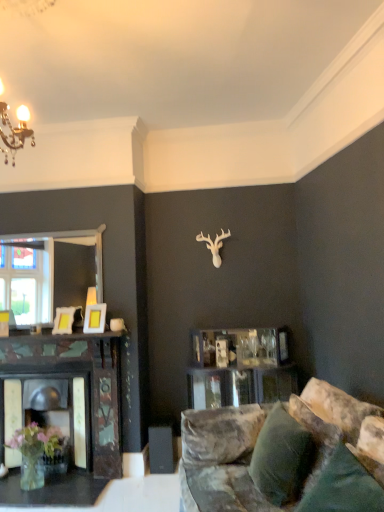
Question: Would you consider matte gold picture frame at left, the first picture frame when ordered from left to right, to be distant from velvety green pillow at lower right, arranged as the first pillow when viewed from the front?

Choices:
 (A) yes
 (B) no

Answer: (A)

Question: Is matte gold picture frame at left, placed as the second picture frame when sorted from right to left, bigger than velvety green pillow at lower right, the second pillow from the back?

Choices:
 (A) yes
 (B) no

Answer: (B)

Question: Considering the relative positions of matte gold picture frame at left, the first picture frame when ordered from left to right, and velvety green pillow at lower right, arranged as the first pillow when viewed from the front, in the image provided, is matte gold picture frame at left, the first picture frame when ordered from left to right, behind velvety green pillow at lower right, arranged as the first pillow when viewed from the front,?

Choices:
 (A) yes
 (B) no

Answer: (A)

Question: From a real-world perspective, is matte gold picture frame at left, placed as the second picture frame when sorted from right to left, physically above velvety green pillow at lower right, the second pillow from the back?

Choices:
 (A) no
 (B) yes

Answer: (B)

Question: From a real-world perspective, is matte gold picture frame at left, placed as the second picture frame when sorted from right to left, located beneath velvety green pillow at lower right, the second pillow from the back?

Choices:
 (A) no
 (B) yes

Answer: (A)

Question: Considering the relative positions of matte gold picture frame at left, placed as the second picture frame when sorted from right to left, and velvety green pillow at lower right, arranged as the first pillow when viewed from the front, in the image provided, is matte gold picture frame at left, placed as the second picture frame when sorted from right to left, to the right of velvety green pillow at lower right, arranged as the first pillow when viewed from the front, from the viewer's perspective?

Choices:
 (A) yes
 (B) no

Answer: (B)

Question: Considering the relative sizes of matte yellow picture frame at center, marked as the first picture frame in a right-to-left arrangement, and velvety green pillow at lower right, arranged as the first pillow when viewed from the front, in the image provided, is matte yellow picture frame at center, marked as the first picture frame in a right-to-left arrangement, shorter than velvety green pillow at lower right, arranged as the first pillow when viewed from the front,?

Choices:
 (A) no
 (B) yes

Answer: (B)

Question: Can you confirm if matte yellow picture frame at center, the second picture frame positioned from the left, is smaller than velvety green pillow at lower right, the second pillow from the back?

Choices:
 (A) no
 (B) yes

Answer: (B)

Question: From the image's perspective, is matte yellow picture frame at center, marked as the first picture frame in a right-to-left arrangement, located above velvety green pillow at lower right, arranged as the first pillow when viewed from the front?

Choices:
 (A) yes
 (B) no

Answer: (A)

Question: Considering the relative positions of matte yellow picture frame at center, the second picture frame positioned from the left, and velvety green pillow at lower right, the second pillow from the back, in the image provided, is matte yellow picture frame at center, the second picture frame positioned from the left, in front of velvety green pillow at lower right, the second pillow from the back,?

Choices:
 (A) no
 (B) yes

Answer: (A)

Question: Considering the relative sizes of matte yellow picture frame at center, marked as the first picture frame in a right-to-left arrangement, and velvety green pillow at lower right, the second pillow from the back, in the image provided, is matte yellow picture frame at center, marked as the first picture frame in a right-to-left arrangement, thinner than velvety green pillow at lower right, the second pillow from the back,?

Choices:
 (A) no
 (B) yes

Answer: (B)

Question: From a real-world perspective, is matte yellow picture frame at center, the second picture frame positioned from the left, physically above velvety green pillow at lower right, the second pillow from the back?

Choices:
 (A) no
 (B) yes

Answer: (B)

Question: Would you consider velvet green pillow at lower right, the second pillow in the front-to-back sequence, to be distant from matte yellow picture frame at center, the second picture frame positioned from the left?

Choices:
 (A) no
 (B) yes

Answer: (B)